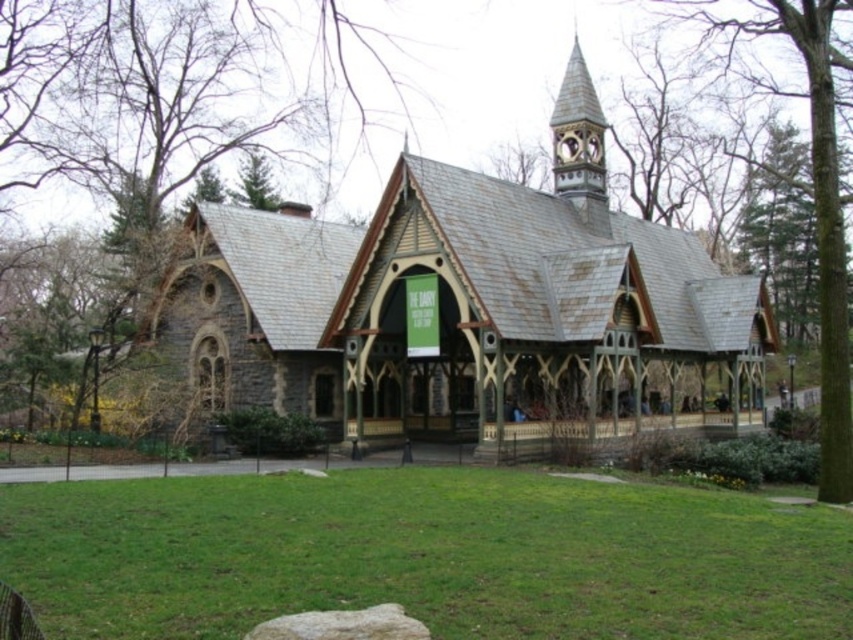
Can you confirm if rusty metal church at center is bigger than gray rough stone at lower center?

Correct, rusty metal church at center is larger in size than gray rough stone at lower center.

Which is behind, point (194, 384) or point (288, 625)?

The point (194, 384) is behind.

Between point (285, 392) and point (279, 628), which one is positioned behind?

Point (285, 392)

Where is `rusty metal church at center`? This screenshot has height=640, width=853. rusty metal church at center is located at coordinates (469, 308).

Measure the distance between rusty metal church at center and camera.

rusty metal church at center and camera are 61.93 meters apart from each other.

Which is in front, point (428, 211) or point (155, 177)?

Positioned in front is point (428, 211).

The width and height of the screenshot is (853, 640). What do you see at coordinates (469, 308) in the screenshot?
I see `rusty metal church at center` at bounding box center [469, 308].

You are a GUI agent. You are given a task and a screenshot of the screen. Output one action in this format:
    pyautogui.click(x=<x>, y=<y>)
    Task: Click on the rusty metal church at center
    The height and width of the screenshot is (640, 853).
    Given the screenshot: What is the action you would take?
    pyautogui.click(x=469, y=308)

Between rusty metal church at center and green grass at center, which one appears on the right side from the viewer's perspective?

Positioned to the right is rusty metal church at center.

Does rusty metal church at center have a larger size compared to green grass at center?

Correct, rusty metal church at center is larger in size than green grass at center.

Who is more forward, (239, 276) or (84, 483)?

Positioned in front is point (84, 483).

Where is `rusty metal church at center`? rusty metal church at center is located at coordinates (469, 308).